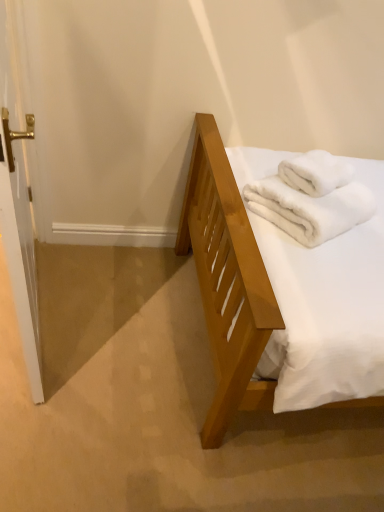
What is the approximate height of white fluffy bath towel at upper right, the second bath towel viewed from the top?

The height of white fluffy bath towel at upper right, the second bath towel viewed from the top, is 16.85 centimeters.

This screenshot has width=384, height=512. What are the coordinates of `white fluffy bath towel at upper right, positioned as the 1th bath towel in top-to-bottom order` in the screenshot? It's located at (315, 173).

Find the location of a particular element. white fluffy bath towel at upper right, arranged as the first bath towel when ordered from the bottom is located at coordinates (308, 207).

Who is bigger, white fluffy bath towel at upper right, arranged as the first bath towel when ordered from the bottom, or white glossy door handle at left?

white glossy door handle at left is bigger.

Is white fluffy bath towel at upper right, arranged as the first bath towel when ordered from the bottom, facing away from white glossy door handle at left?

No, white glossy door handle at left is not at the back of white fluffy bath towel at upper right, arranged as the first bath towel when ordered from the bottom.

Can we say white fluffy bath towel at upper right, arranged as the first bath towel when ordered from the bottom, lies outside white glossy door handle at left?

That's correct, white fluffy bath towel at upper right, arranged as the first bath towel when ordered from the bottom, is outside of white glossy door handle at left.

Is white fluffy bath towel at upper right, placed as the second bath towel when sorted from bottom to top, oriented towards white glossy door handle at left?

No, white fluffy bath towel at upper right, placed as the second bath towel when sorted from bottom to top, is not facing towards white glossy door handle at left.

Where is `the 2nd bath towel behind the white glossy door handle at left`? The image size is (384, 512). the 2nd bath towel behind the white glossy door handle at left is located at coordinates (315, 173).

Is white fluffy bath towel at upper right, placed as the second bath towel when sorted from bottom to top, in contact with white glossy door handle at left?

No, white fluffy bath towel at upper right, placed as the second bath towel when sorted from bottom to top, is not with white glossy door handle at left.

Is white fluffy bath towel at upper right, positioned as the 1th bath towel in top-to-bottom order, located outside white glossy door handle at left?

Yes, white fluffy bath towel at upper right, positioned as the 1th bath towel in top-to-bottom order, is outside of white glossy door handle at left.

From the picture: Measure the distance between white glossy door handle at left and white fluffy bath towel at upper right, positioned as the 1th bath towel in top-to-bottom order.

The distance of white glossy door handle at left from white fluffy bath towel at upper right, positioned as the 1th bath towel in top-to-bottom order, is 35.35 inches.

Which object is closer to the camera taking this photo, white glossy door handle at left or white fluffy bath towel at upper right, positioned as the 1th bath towel in top-to-bottom order?

white glossy door handle at left is more forward.

Which is more to the left, white glossy door handle at left or white fluffy bath towel at upper right, placed as the second bath towel when sorted from bottom to top?

white glossy door handle at left is more to the left.

From a real-world perspective, is white glossy door handle at left under white fluffy bath towel at upper right, positioned as the 1th bath towel in top-to-bottom order?

Correct, in the physical world, white glossy door handle at left is lower than white fluffy bath towel at upper right, positioned as the 1th bath towel in top-to-bottom order.

Between white fluffy bath towel at upper right, positioned as the 1th bath towel in top-to-bottom order, and white fluffy bath towel at upper right, the second bath towel viewed from the top, which one has less height?

white fluffy bath towel at upper right, positioned as the 1th bath towel in top-to-bottom order.

Based on the photo, between white fluffy bath towel at upper right, positioned as the 1th bath towel in top-to-bottom order, and white fluffy bath towel at upper right, arranged as the first bath towel when ordered from the bottom, which one has smaller width?

white fluffy bath towel at upper right, positioned as the 1th bath towel in top-to-bottom order, is thinner.

Does white fluffy bath towel at upper right, placed as the second bath towel when sorted from bottom to top, have a larger size compared to white fluffy bath towel at upper right, arranged as the first bath towel when ordered from the bottom?

No, white fluffy bath towel at upper right, placed as the second bath towel when sorted from bottom to top, is not bigger than white fluffy bath towel at upper right, arranged as the first bath towel when ordered from the bottom.

Is white fluffy bath towel at upper right, positioned as the 1th bath towel in top-to-bottom order, in front of or behind white fluffy bath towel at upper right, the second bath towel viewed from the top, in the image?

Visually, white fluffy bath towel at upper right, positioned as the 1th bath towel in top-to-bottom order, is located behind white fluffy bath towel at upper right, the second bath towel viewed from the top.

Can you tell me how much white fluffy bath towel at upper right, the second bath towel viewed from the top, and white fluffy bath towel at upper right, positioned as the 1th bath towel in top-to-bottom order, differ in facing direction?

The angular difference between white fluffy bath towel at upper right, the second bath towel viewed from the top, and white fluffy bath towel at upper right, positioned as the 1th bath towel in top-to-bottom order, is 0.0508 degrees.

Which of these two, white fluffy bath towel at upper right, the second bath towel viewed from the top, or white fluffy bath towel at upper right, placed as the second bath towel when sorted from bottom to top, is thinner?

With smaller width is white fluffy bath towel at upper right, placed as the second bath towel when sorted from bottom to top.

Between white fluffy bath towel at upper right, arranged as the first bath towel when ordered from the bottom, and white fluffy bath towel at upper right, positioned as the 1th bath towel in top-to-bottom order, which one has more height?

white fluffy bath towel at upper right, arranged as the first bath towel when ordered from the bottom.

This screenshot has width=384, height=512. What are the coordinates of `bath towel located behind the white fluffy bath towel at upper right, the second bath towel viewed from the top` in the screenshot? It's located at (315, 173).

From the image's perspective, who appears lower, white glossy door handle at left or white fluffy bath towel at upper right, the second bath towel viewed from the top?

white glossy door handle at left.

Is white fluffy bath towel at upper right, the second bath towel viewed from the top, a part of white glossy door handle at left?

No.

Locate an element on the screen. This screenshot has width=384, height=512. screen door in front of the white fluffy bath towel at upper right, arranged as the first bath towel when ordered from the bottom is located at coordinates (18, 213).

Does white glossy door handle at left lie in front of white fluffy bath towel at upper right, the second bath towel viewed from the top?

Yes, white glossy door handle at left is closer to the camera.

Locate an element on the screen. Image resolution: width=384 pixels, height=512 pixels. the 1st bath towel positioned above the white glossy door handle at left (from the image's perspective) is located at coordinates (308, 207).

Locate an element on the screen. This screenshot has height=512, width=384. screen door on the left of the white fluffy bath towel at upper right, positioned as the 1th bath towel in top-to-bottom order is located at coordinates (18, 213).

Estimate the real-world distances between objects in this image. Which object is further from white fluffy bath towel at upper right, positioned as the 1th bath towel in top-to-bottom order, white glossy door handle at left or white fluffy bath towel at upper right, arranged as the first bath towel when ordered from the bottom?

Among the two, white glossy door handle at left is located further to white fluffy bath towel at upper right, positioned as the 1th bath towel in top-to-bottom order.

Consider the image. When comparing their distances from white fluffy bath towel at upper right, placed as the second bath towel when sorted from bottom to top, does white fluffy bath towel at upper right, arranged as the first bath towel when ordered from the bottom, or white glossy door handle at left seem further?

white glossy door handle at left is further to white fluffy bath towel at upper right, placed as the second bath towel when sorted from bottom to top.

Considering their positions, is white glossy door handle at left positioned further to white fluffy bath towel at upper right, the second bath towel viewed from the top, than white fluffy bath towel at upper right, positioned as the 1th bath towel in top-to-bottom order?

white glossy door handle at left lies further to white fluffy bath towel at upper right, the second bath towel viewed from the top, than the other object.

From the image, which object appears to be nearer to white glossy door handle at left, white fluffy bath towel at upper right, positioned as the 1th bath towel in top-to-bottom order, or white fluffy bath towel at upper right, arranged as the first bath towel when ordered from the bottom?

The object closer to white glossy door handle at left is white fluffy bath towel at upper right, arranged as the first bath towel when ordered from the bottom.

From the image, which object appears to be nearer to white glossy door handle at left, white fluffy bath towel at upper right, the second bath towel viewed from the top, or white fluffy bath towel at upper right, positioned as the 1th bath towel in top-to-bottom order?

white fluffy bath towel at upper right, the second bath towel viewed from the top, is positioned closer to the anchor white glossy door handle at left.

Considering their positions, is white fluffy bath towel at upper right, placed as the second bath towel when sorted from bottom to top, positioned closer to white fluffy bath towel at upper right, arranged as the first bath towel when ordered from the bottom, than white glossy door handle at left?

white fluffy bath towel at upper right, placed as the second bath towel when sorted from bottom to top, lies closer to white fluffy bath towel at upper right, arranged as the first bath towel when ordered from the bottom, than the other object.

Find the location of a particular element. The width and height of the screenshot is (384, 512). bath towel between white glossy door handle at left and white fluffy bath towel at upper right, positioned as the 1th bath towel in top-to-bottom order, in the horizontal direction is located at coordinates (308, 207).